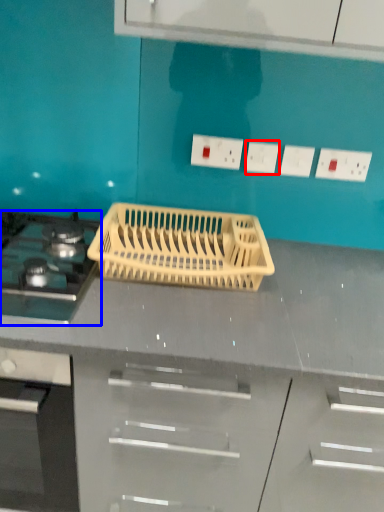
Question: Among these objects, which one is farthest to the camera, electric outlet (highlighted by a red box) or gas stove (highlighted by a blue box)?

Choices:
 (A) electric outlet
 (B) gas stove

Answer: (A)